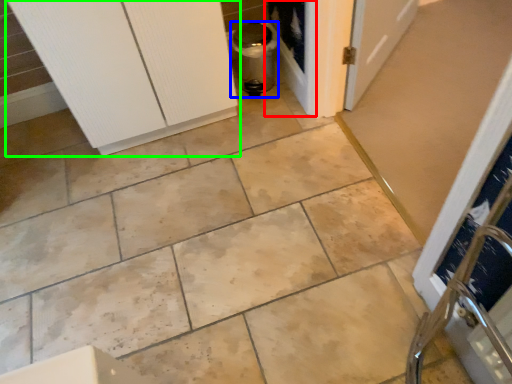
Question: Estimate the real-world distances between objects in this image. Which object is farther from screen door (highlighted by a red box), appliance (highlighted by a blue box) or door (highlighted by a green box)?

Choices:
 (A) appliance
 (B) door

Answer: (B)